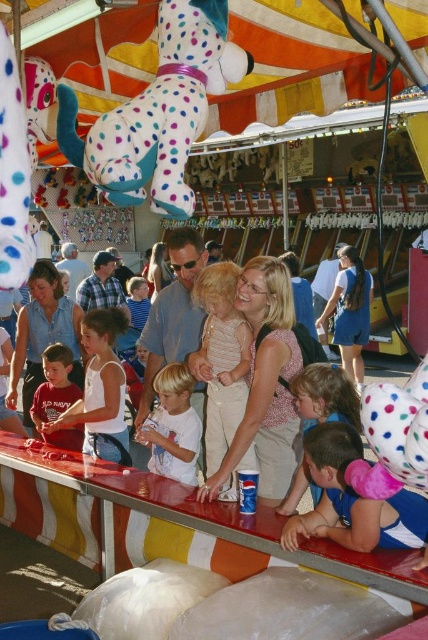
You are a photographer at the carnival and want to take a photo of the matte pink blouse at center and the light beige cotton dress at center. Which one should you focus on first if you want to capture both clearly in the same frame?

A: The matte pink blouse at center is bigger than the light beige cotton dress at center, so you should focus on the matte pink blouse at center first to ensure it is in clear focus before adjusting for the smaller light beige cotton dress at center.

You are standing at the carnival booth counter and want to reach the prize area. The prize area is behind the counter. There are two points marked on the counter surface. One is at point (309,445) and the other is at point (220,381). Which point is closer to you as you stand at the counter?

Point (309,445) is in front of point (220,381), so the point closer to you is point (309,445).

You are a photographer at the carnival and want to take a photo of the matte pink blouse at center and the matte blue shirt at center. Which one should you focus on first if you want to capture both clearly in the same frame?

A: The matte pink blouse at center is shorter than the matte blue shirt at center. Since the matte pink blouse at center is closer to the camera, you should focus on it first to ensure both are in focus.